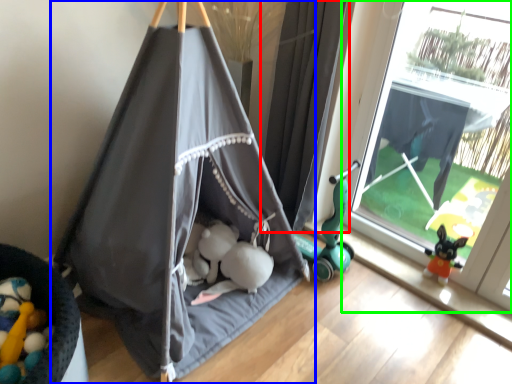
Question: Which object is positioned closest to curtain (highlighted by a red box)? Select from tent (highlighted by a blue box) and window (highlighted by a green box).

Choices:
 (A) tent
 (B) window

Answer: (A)